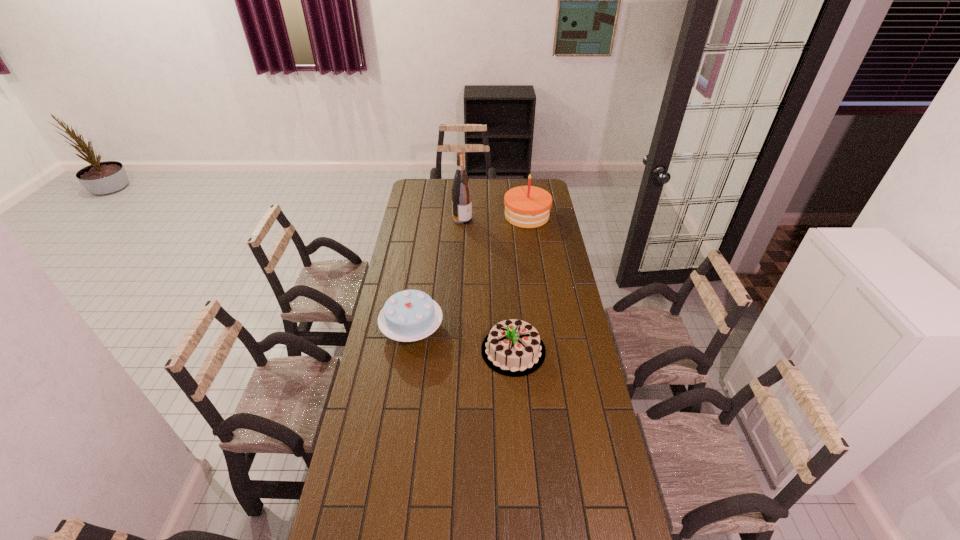
What are the coordinates of `wine bottle` in the screenshot? It's located at (461, 190).

Where is `the second object from left to right`? This screenshot has width=960, height=540. the second object from left to right is located at coordinates (461, 190).

Where is `the tallest birthday cake`? This screenshot has height=540, width=960. the tallest birthday cake is located at coordinates (528, 206).

You are a GUI agent. You are given a task and a screenshot of the screen. Output one action in this format:
    pyautogui.click(x=<x>, y=<y>)
    Task: Click on the second tallest object
    Image resolution: width=960 pixels, height=540 pixels.
    Given the screenshot: What is the action you would take?
    pyautogui.click(x=528, y=206)

I want to click on the leftmost birthday cake, so click(x=410, y=315).

Image resolution: width=960 pixels, height=540 pixels. What are the coordinates of `vacant area situated 0.120m on the left of the tallest object` in the screenshot? It's located at [431, 219].

Locate an element on the screen. This screenshot has width=960, height=540. vacant space located on the left of the tallest birthday cake is located at coordinates (444, 215).

This screenshot has width=960, height=540. In order to click on vacant space located 0.380m on the front of the leftmost object in this screenshot , I will do `click(395, 442)`.

Locate an element on the screen. The height and width of the screenshot is (540, 960). object located in the left edge section of the desktop is located at coordinates (410, 315).

Identify the location of object located in the right edge section of the desktop. (528, 206).